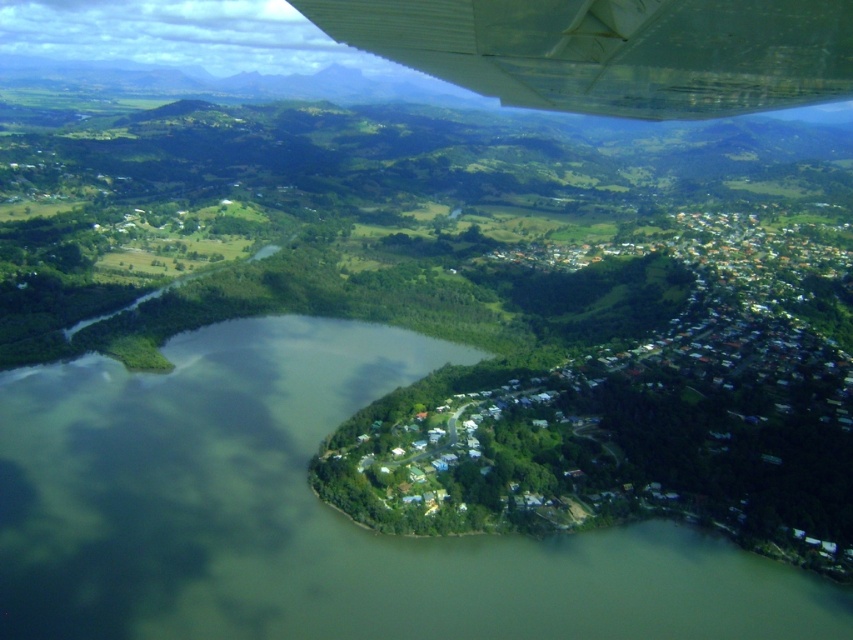
You are a passenger looking out the airplane window and see two points marked on the landscape below. The first point is at coordinates point (701,593) and the second is at point (537,81). Which point is closer to the airplane?

Point (537,81) is closer to the airplane because point (701,593) is behind it.

You are a passenger on an airplane and notice the green water at center and the white metallic wing at upper center through the window. Which object appears closer to you?

The green water at center appears closer because it is taller than the white metallic wing at upper center, indicating it occupies more space in the field of view from your perspective.